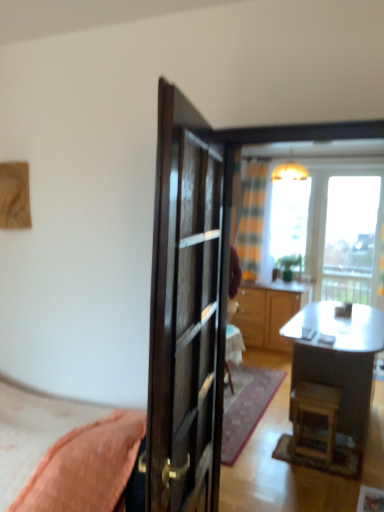
Question: From a real-world perspective, is metallic silver desk at center below wooden stool at lower right?

Choices:
 (A) yes
 (B) no

Answer: (B)

Question: Does metallic silver desk at center have a lesser height compared to wooden stool at lower right?

Choices:
 (A) yes
 (B) no

Answer: (B)

Question: Considering the relative positions of metallic silver desk at center and wooden stool at lower right in the image provided, is metallic silver desk at center to the right of wooden stool at lower right from the viewer's perspective?

Choices:
 (A) no
 (B) yes

Answer: (B)

Question: From the image's perspective, is metallic silver desk at center above wooden stool at lower right?

Choices:
 (A) yes
 (B) no

Answer: (A)

Question: Is metallic silver desk at center wider than wooden stool at lower right?

Choices:
 (A) no
 (B) yes

Answer: (B)

Question: From the image's perspective, is matte yellow lampshade at upper center above or below transparent glass window at upper right?

Choices:
 (A) below
 (B) above

Answer: (B)

Question: Is matte yellow lampshade at upper center taller or shorter than transparent glass window at upper right?

Choices:
 (A) tall
 (B) short

Answer: (B)

Question: Considering the relative positions of matte yellow lampshade at upper center and transparent glass window at upper right in the image provided, is matte yellow lampshade at upper center to the left or to the right of transparent glass window at upper right?

Choices:
 (A) left
 (B) right

Answer: (A)

Question: In terms of width, does matte yellow lampshade at upper center look wider or thinner when compared to transparent glass window at upper right?

Choices:
 (A) wide
 (B) thin

Answer: (A)

Question: In the image, is green matte houseplant at center on the left side or the right side of plaid fabric curtain at center?

Choices:
 (A) left
 (B) right

Answer: (B)

Question: Is point coord(284,260) closer or farther from the camera than point coord(258,239)?

Choices:
 (A) farther
 (B) closer

Answer: (B)

Question: From their relative heights in the image, would you say green matte houseplant at center is taller or shorter than plaid fabric curtain at center?

Choices:
 (A) short
 (B) tall

Answer: (A)

Question: Considering the positions of green matte houseplant at center and plaid fabric curtain at center in the image, is green matte houseplant at center wider or thinner than plaid fabric curtain at center?

Choices:
 (A) thin
 (B) wide

Answer: (A)

Question: Considering the relative positions of wooden cabinet at center and glossy dark wood door at center in the image provided, is wooden cabinet at center to the left or to the right of glossy dark wood door at center?

Choices:
 (A) right
 (B) left

Answer: (A)

Question: From the image's perspective, relative to glossy dark wood door at center, is wooden cabinet at center above or below?

Choices:
 (A) above
 (B) below

Answer: (B)